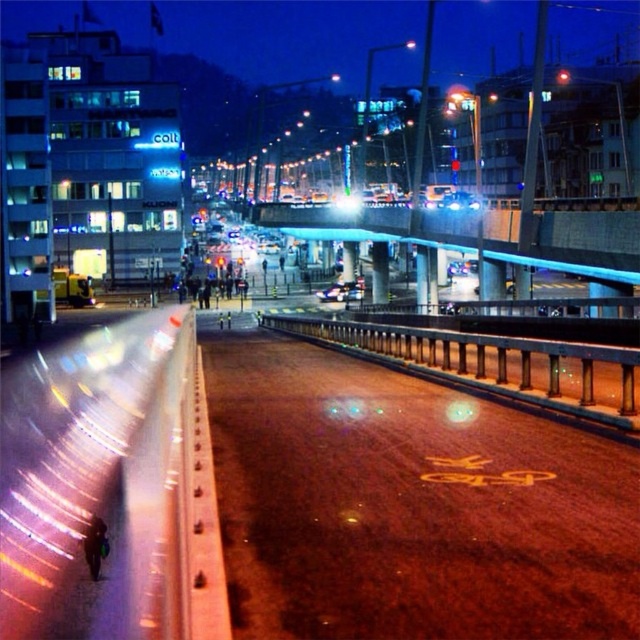
Question: Among these objects, which one is farthest from the camera?

Choices:
 (A) metallic silver car at center
 (B) blue glass bridge at center

Answer: (A)

Question: Can you confirm if yellow asphalt at center is bigger than blue glass bridge at center?

Choices:
 (A) yes
 (B) no

Answer: (B)

Question: Which point is closer to the camera?

Choices:
 (A) metallic silver car at center
 (B) yellow asphalt at center
 (C) blue glass bridge at center

Answer: (B)

Question: Which is farther from the metallic silver car at center?

Choices:
 (A) yellow asphalt at center
 (B) blue glass bridge at center

Answer: (A)

Question: Where is yellow asphalt at center located in relation to blue glass bridge at center in the image?

Choices:
 (A) left
 (B) right

Answer: (A)

Question: Can you confirm if yellow asphalt at center is positioned to the right of metallic silver car at center?

Choices:
 (A) no
 (B) yes

Answer: (A)